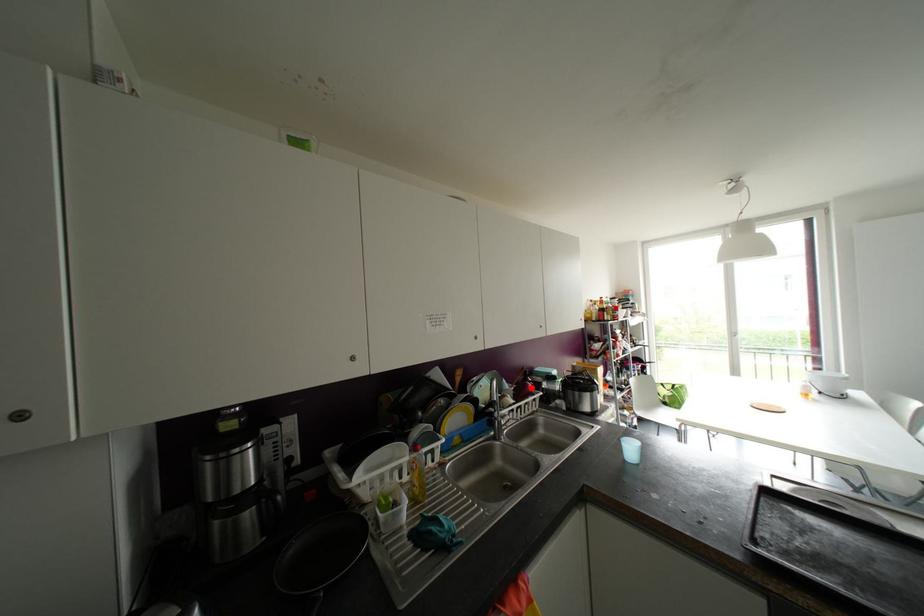
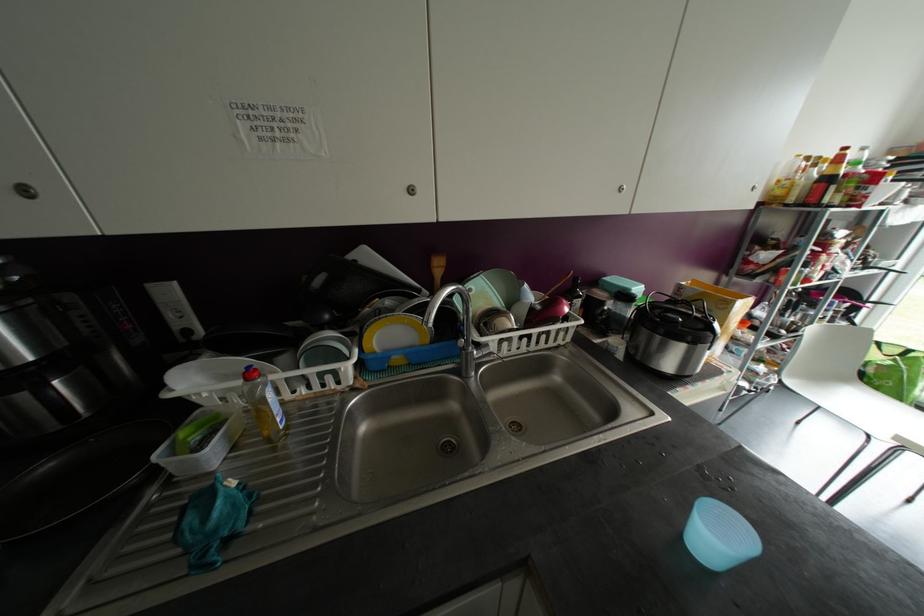
In the second image, find the point that corresponds to the highlighted location in the first image.

(565, 310)